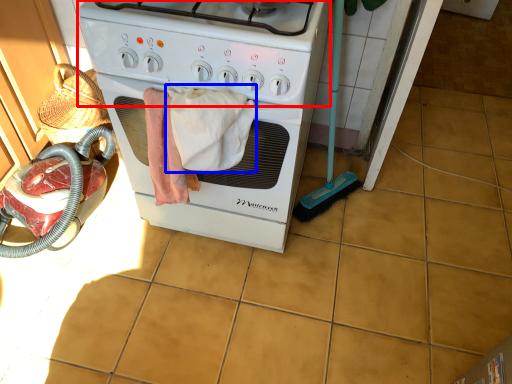
Question: Among these objects, which one is farthest to the camera, gas stove (highlighted by a red box) or bath towel (highlighted by a blue box)?

Choices:
 (A) gas stove
 (B) bath towel

Answer: (B)